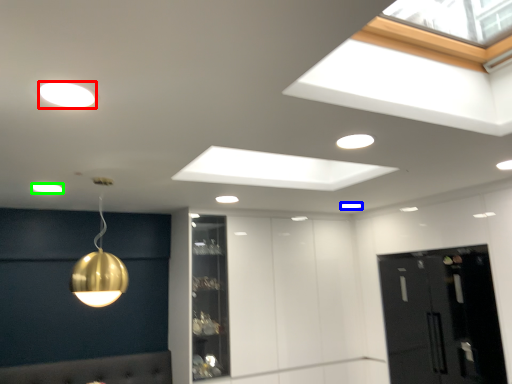
Question: Which is nearer to the lamp (highlighted by a red box)? lamp (highlighted by a blue box) or lamp (highlighted by a green box).

Choices:
 (A) lamp
 (B) lamp

Answer: (B)